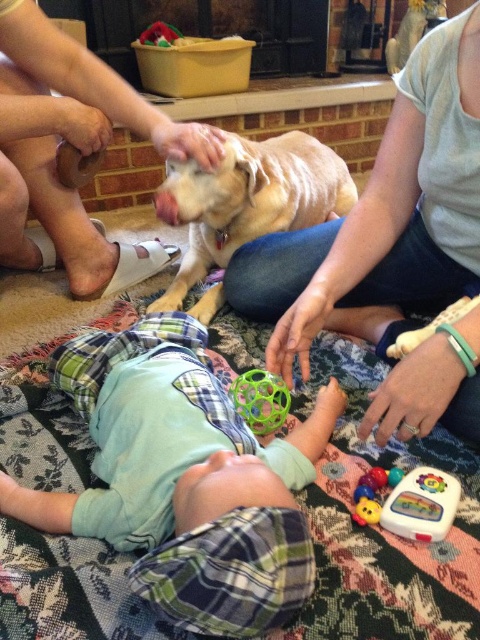
You are a parent holding a baby who is lying on a patterned blanket. You see the rubberized plastic toy at lower right and the rubber teething ring at lower center. Which toy is positioned to the left of the other?

The rubberized plastic toy at lower right is to the left of the rubber teething ring at lower center.

You are a parent trying to dress your baby. You have a light blue cotton shirt at center and a translucent rubber ball at center. Which item is wider?

The light blue cotton shirt at center is wider than the translucent rubber ball at center.

You are a parent holding a baby. You want to give the baby the toy located at point (252, 428). The baby is currently at point (302, 323). Can you reach the toy without moving past the baby?

Point (302, 323) is in front of point (252, 428), so the toy at point (252, 428) is behind the baby. Therefore, you can reach it without moving past the baby.